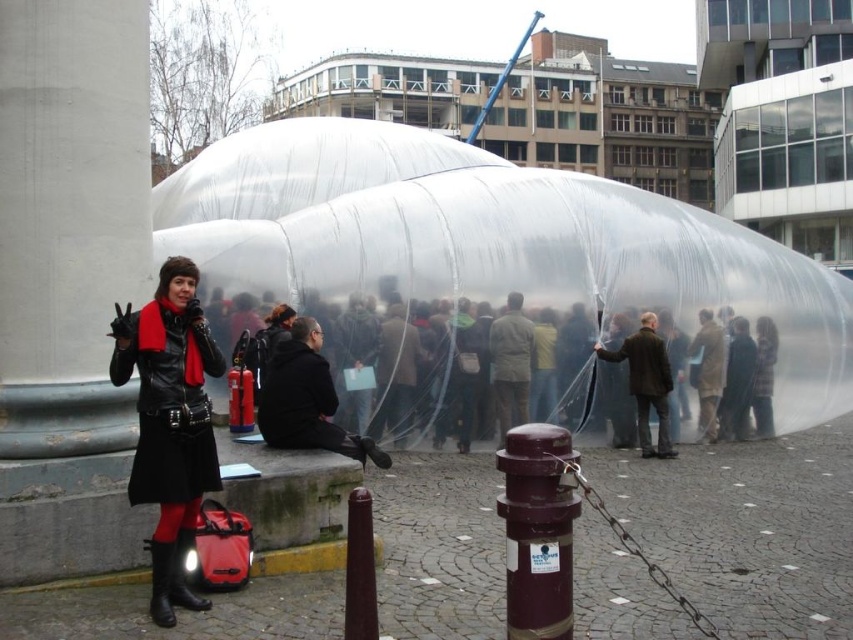
You are a photographer standing at the edge of the plaza. You want to take a photo of the maroon metallic hydrant at center and the shiny black boot at lower left. Which object should you adjust your camera focus on first if you want to capture both in focus?

The maroon metallic hydrant at center is located above the shiny black boot at lower left, so you should focus on the maroon metallic hydrant at center first as it is closer to the camera.